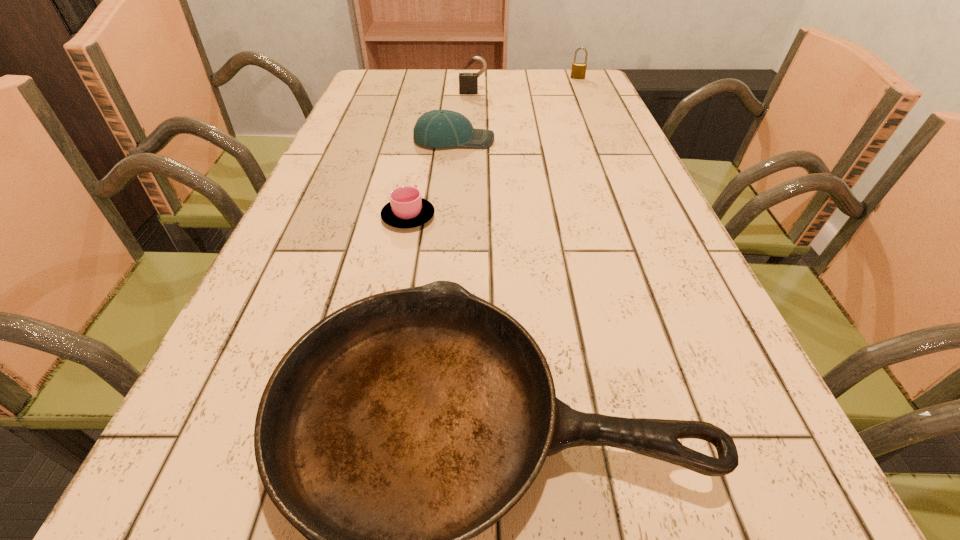
The image size is (960, 540). Find the location of `the second farthest object`. the second farthest object is located at coordinates (468, 82).

Identify the location of the left padlock. Image resolution: width=960 pixels, height=540 pixels. (468, 82).

Where is `the farther padlock`? This screenshot has width=960, height=540. the farther padlock is located at coordinates (578, 71).

Locate an element on the screen. the farthest object is located at coordinates (578, 71).

Where is `baseball cap`? This screenshot has width=960, height=540. baseball cap is located at coordinates (438, 128).

Locate an element on the screen. The height and width of the screenshot is (540, 960). the second nearest object is located at coordinates pyautogui.click(x=406, y=209).

You are a GUI agent. You are given a task and a screenshot of the screen. Output one action in this format:
    pyautogui.click(x=<x>, y=<y>)
    Task: Click on the shortest object
    The width and height of the screenshot is (960, 540).
    Given the screenshot: What is the action you would take?
    pyautogui.click(x=406, y=209)

This screenshot has height=540, width=960. Find the location of `free region located 0.320m with the keyhole on the front of the left padlock`. free region located 0.320m with the keyhole on the front of the left padlock is located at coordinates (471, 145).

Image resolution: width=960 pixels, height=540 pixels. I want to click on free space located on the front of the farther padlock, so click(x=581, y=85).

What are the coordinates of `blank space located on the back of the baseball cap` in the screenshot? It's located at (458, 92).